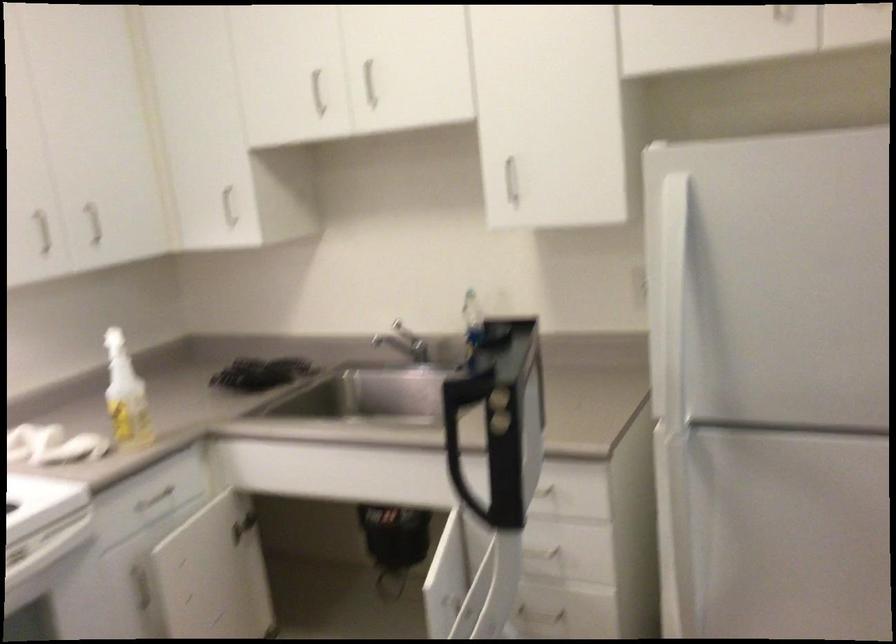
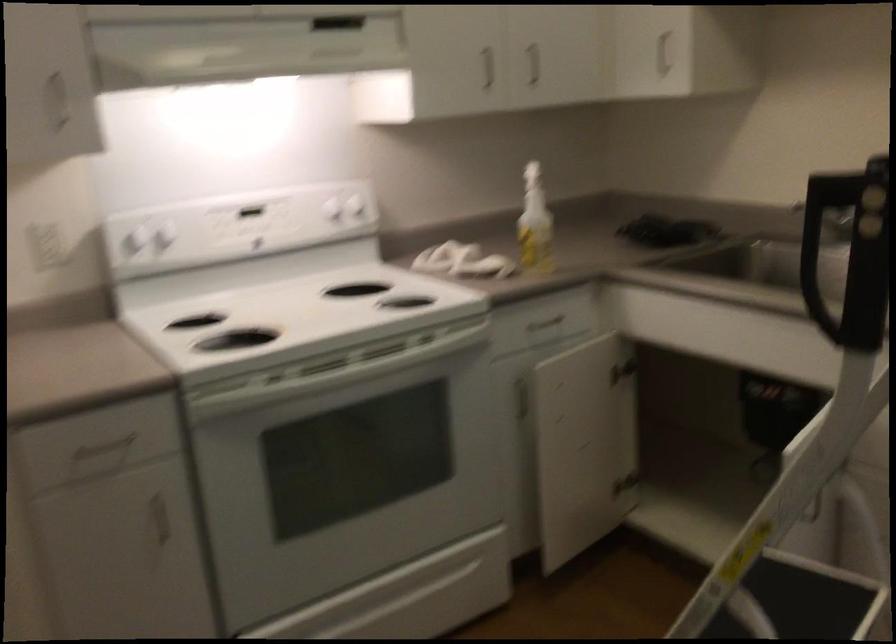
Where in the second image is the point corresponding to [126,399] from the first image?

(535, 223)